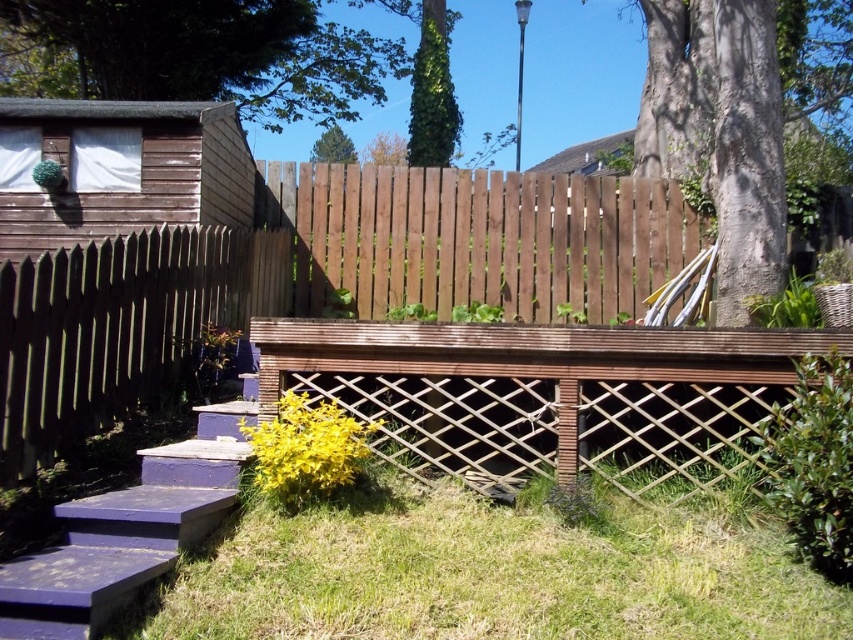
Question: Can you confirm if green grass at lower center is positioned to the right of purple painted wood stairs at lower left?

Choices:
 (A) yes
 (B) no

Answer: (A)

Question: Can you confirm if brown wooden fence at center is positioned to the right of brown wooden fence at left?

Choices:
 (A) no
 (B) yes

Answer: (B)

Question: Which point is closer to the camera?

Choices:
 (A) green grass at lower center
 (B) purple painted wood stairs at lower left
 (C) brown wooden fence at left
 (D) brown wooden fence at center

Answer: (B)

Question: Among these objects, which one is farthest from the camera?

Choices:
 (A) brown wooden fence at left
 (B) brown wooden fence at center

Answer: (B)

Question: Can you confirm if green grass at lower center is positioned below brown wooden fence at left?

Choices:
 (A) yes
 (B) no

Answer: (A)

Question: Which object is farther from the camera taking this photo?

Choices:
 (A) purple painted wood stairs at lower left
 (B) green grass at lower center
 (C) brown wooden deck at center

Answer: (C)